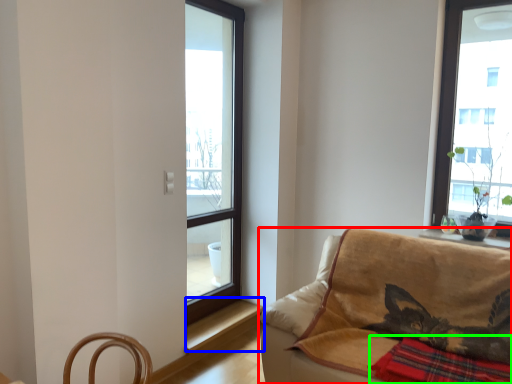
Question: Which object is positioned closest to studio couch (highlighted by a red box)? Select from window sill (highlighted by a blue box) and plaid (highlighted by a green box).

Choices:
 (A) window sill
 (B) plaid

Answer: (B)